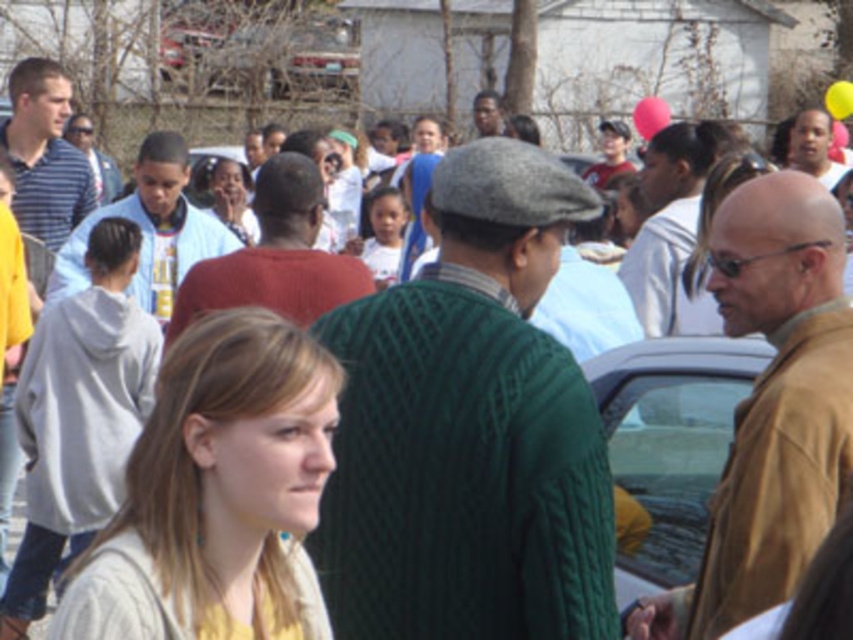
You are standing in the crowd at this outdoor gathering and want to find the light gray hoodie at center and the matte white shirt at center. Based on their positions, which one would you look down at first?

The light gray hoodie at center is located below the matte white shirt at center, so you should look down first to see the light gray hoodie at center after spotting the matte white shirt at center.